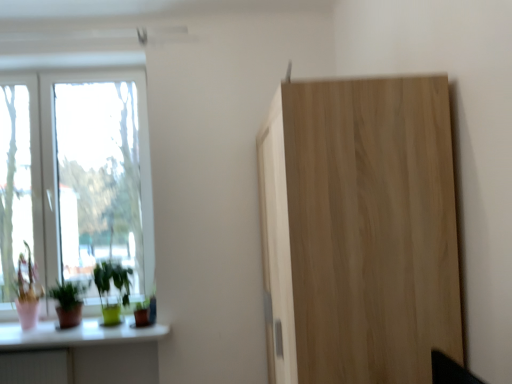
Question: Does green matte plant at lower left, the 1th houseplant from the left, have a larger size compared to natural wood cupboard at right?

Choices:
 (A) yes
 (B) no

Answer: (B)

Question: From a real-world perspective, is green matte plant at lower left, the 1th houseplant from the left, on natural wood cupboard at right?

Choices:
 (A) yes
 (B) no

Answer: (B)

Question: Does green matte plant at lower left, the 1th houseplant from the left, appear on the right side of natural wood cupboard at right?

Choices:
 (A) no
 (B) yes

Answer: (A)

Question: Is green matte plant at lower left, the second houseplant positioned from the right, positioned with its back to natural wood cupboard at right?

Choices:
 (A) yes
 (B) no

Answer: (B)

Question: From a real-world perspective, is white glass window at left, which ranks as the 2th window in left-to-right order, physically located above or below transparent glass window at left, marked as the 1th window in a left-to-right arrangement?

Choices:
 (A) below
 (B) above

Answer: (B)

Question: Is white glass window at left, marked as the 1th window in a right-to-left arrangement, situated inside transparent glass window at left, marked as the 1th window in a left-to-right arrangement, or outside?

Choices:
 (A) inside
 (B) outside

Answer: (B)

Question: Does point (46, 82) appear closer or farther from the camera than point (10, 241)?

Choices:
 (A) closer
 (B) farther

Answer: (B)

Question: Looking at the image, does white glass window at left, which ranks as the 2th window in left-to-right order, seem bigger or smaller compared to transparent glass window at left, marked as the 1th window in a left-to-right arrangement?

Choices:
 (A) big
 (B) small

Answer: (A)

Question: Is white glass window at left, marked as the 1th window in a right-to-left arrangement, wider or thinner than green glossy plant at lower left, acting as the second houseplant starting from the left?

Choices:
 (A) wide
 (B) thin

Answer: (B)

Question: Does point (112, 203) appear closer or farther from the camera than point (94, 279)?

Choices:
 (A) closer
 (B) farther

Answer: (B)

Question: Which is correct: white glass window at left, marked as the 1th window in a right-to-left arrangement, is inside green glossy plant at lower left, the 1th houseplant in the right-to-left sequence, or outside of it?

Choices:
 (A) outside
 (B) inside

Answer: (A)

Question: From their relative heights in the image, would you say white glass window at left, marked as the 1th window in a right-to-left arrangement, is taller or shorter than green glossy plant at lower left, acting as the second houseplant starting from the left?

Choices:
 (A) short
 (B) tall

Answer: (B)

Question: In the image, is green matte plant at lower left, the 1th houseplant from the left, on the left side or the right side of transparent glass window at left, marked as the 1th window in a left-to-right arrangement?

Choices:
 (A) right
 (B) left

Answer: (A)

Question: Looking at their shapes, would you say green matte plant at lower left, the second houseplant positioned from the right, is wider or thinner than transparent glass window at left, the second window viewed from the right?

Choices:
 (A) thin
 (B) wide

Answer: (B)